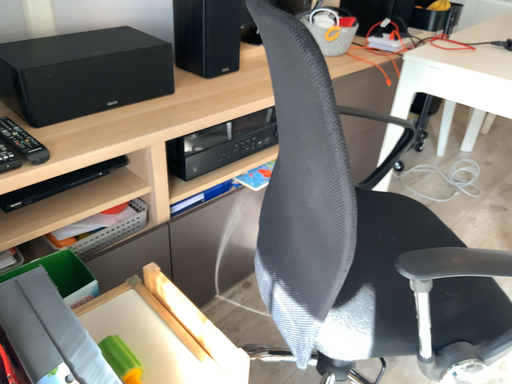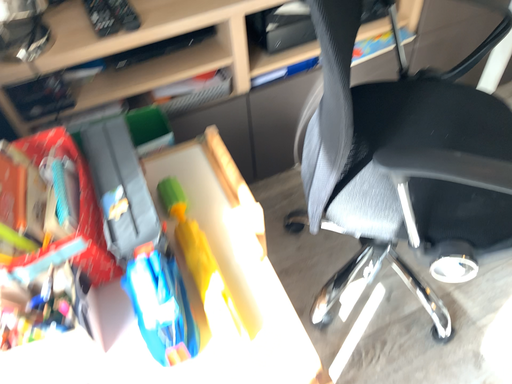
Question: How did the camera likely rotate when shooting the video?

Choices:
 (A) rotated right
 (B) rotated left

Answer: (B)